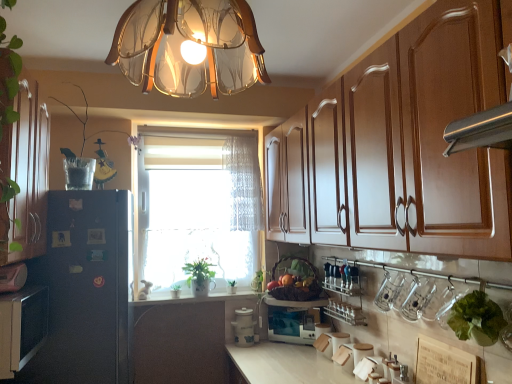
This screenshot has height=384, width=512. What are the coordinates of `black matte refrigerator at left` in the screenshot? It's located at (88, 288).

What is the approximate width of black matte refrigerator at left?

black matte refrigerator at left is 22.98 inches wide.

Describe the element at coordinates (22, 327) in the screenshot. This screenshot has width=512, height=384. I see `black matte refrigerator at left, which is counted as the 2th cabinetry, starting from the left` at that location.

Measure the distance between translucent glass vase at left, positioned as the 4th plant in right-to-left order, and camera.

A distance of 2.31 meters exists between translucent glass vase at left, positioned as the 4th plant in right-to-left order, and camera.

You are a GUI agent. You are given a task and a screenshot of the screen. Output one action in this format:
    pyautogui.click(x=<x>, y=<y>)
    Task: Click on the white glossy counter top at center
    
    Given the screenshot: What is the action you would take?
    click(x=195, y=297)

Where is `white lace curtain at center`? The image size is (512, 384). white lace curtain at center is located at coordinates (244, 182).

What are the coordinates of `green leafy plant at window, which is counted as the second plant, starting from the left` in the screenshot? It's located at (175, 288).

From a real-world perspective, who is located lower, green leafy lettuce at lower right, marked as the 2th plant in a top-to-bottom arrangement, or green matte plant at center?

green matte plant at center is physically lower.

Is green matte plant at center located within green leafy lettuce at lower right, positioned as the fourth plant in back-to-front order?

Definitely not — green matte plant at center is not inside green leafy lettuce at lower right, positioned as the fourth plant in back-to-front order.

Can you confirm if green leafy lettuce at lower right, the 1th plant in the front-to-back sequence, is bigger than green matte plant at center?

Incorrect, green leafy lettuce at lower right, the 1th plant in the front-to-back sequence, is not larger than green matte plant at center.

How many degrees apart are the facing directions of green leafy lettuce at lower right, marked as the 2th plant in a top-to-bottom arrangement, and green matte plant at center?

The angular difference between green leafy lettuce at lower right, marked as the 2th plant in a top-to-bottom arrangement, and green matte plant at center is 88.9 degrees.

Is the position of metallic silver spice rack at lower center less distant than that of green leafy lettuce at lower right, the 1th plant in the front-to-back sequence?

That is False.

Is metallic silver spice rack at lower center taller than green leafy lettuce at lower right, marked as the 2th plant in a top-to-bottom arrangement?

Yes.

From a real-world perspective, is metallic silver spice rack at lower center over green leafy lettuce at lower right, marked as the 2th plant in a top-to-bottom arrangement?

No, from a real-world perspective, metallic silver spice rack at lower center is not over green leafy lettuce at lower right, marked as the 2th plant in a top-to-bottom arrangement

Are metallic silver spice rack at lower center and green leafy lettuce at lower right, the 1th plant when ordered from right to left, making contact?

No, metallic silver spice rack at lower center is not making contact with green leafy lettuce at lower right, the 1th plant when ordered from right to left.

From a real-world perspective, is green matte plant at center positioned under metallic silver spice rack at lower center based on gravity?

No, from a real-world perspective, green matte plant at center is not beneath metallic silver spice rack at lower center.

Is the depth of green matte plant at center greater than that of metallic silver spice rack at lower center?

Yes, it is.

Looking at their sizes, would you say green matte plant at center is wider or thinner than metallic silver spice rack at lower center?

In the image, green matte plant at center appears to be more narrow than metallic silver spice rack at lower center.

From their relative heights in the image, would you say green matte plant at center is taller or shorter than metallic silver spice rack at lower center?

In the image, green matte plant at center appears to be shorter than metallic silver spice rack at lower center.

From the image's perspective, is black matte refrigerator at left, which is counted as the 2th cabinetry, starting from the left, on green leafy plant at window, the 1th plant from the back?

Indeed, from the image's perspective, black matte refrigerator at left, which is counted as the 2th cabinetry, starting from the left, is shown above green leafy plant at window, the 1th plant from the back.

Which is behind, point (37, 305) or point (233, 282)?

Positioned behind is point (233, 282).

Consider the image. In the image, is black matte refrigerator at left, marked as the 2th cabinetry in a right-to-left arrangement, positioned in front of or behind green leafy plant at window, the 3th plant when ordered from top to bottom?

In the image, black matte refrigerator at left, marked as the 2th cabinetry in a right-to-left arrangement, appears in front of green leafy plant at window, the 3th plant when ordered from top to bottom.

The width and height of the screenshot is (512, 384). What are the coordinates of `the 1st cabinetry in front of the green leafy plant at window, arranged as the 2th plant when viewed from the right` in the screenshot? It's located at (22, 327).

Can you confirm if translucent glass chandelier at upper center is positioned to the left of translucent glass vase at left, which is the fourth plant from bottom to top?

In fact, translucent glass chandelier at upper center is to the right of translucent glass vase at left, which is the fourth plant from bottom to top.

Is translucent glass chandelier at upper center in contact with translucent glass vase at left, positioned as the 4th plant in right-to-left order?

translucent glass chandelier at upper center and translucent glass vase at left, positioned as the 4th plant in right-to-left order, are clearly separated.

From the image's perspective, is translucent glass chandelier at upper center above or below translucent glass vase at left, the first plant in the left-to-right sequence?

translucent glass chandelier at upper center is above translucent glass vase at left, the first plant in the left-to-right sequence.

How far apart are green leafy plant at window, the 3th plant when ordered from top to bottom, and green matte plant at center?

They are 8.60 inches apart.

This screenshot has height=384, width=512. I want to click on houseplant lying above the green leafy plant at window, arranged as the 2th plant when viewed from the right (from the image's perspective), so click(199, 276).

Is green leafy plant at window, which appears as the 4th plant when viewed from the front, facing towards green matte plant at center?

No, green leafy plant at window, which appears as the 4th plant when viewed from the front, does not turn towards green matte plant at center.

Is green leafy plant at window, arranged as the 2th plant when viewed from the right, in front of or behind green matte plant at center in the image?

In the image, green leafy plant at window, arranged as the 2th plant when viewed from the right, appears behind green matte plant at center.

Which of these two, white ceramic container at center, the second appliance in the right-to-left sequence, or matte black microwave at center, the second appliance in the left-to-right sequence, stands taller?

With more height is white ceramic container at center, the second appliance in the right-to-left sequence.

Which is in front, point (250, 315) or point (306, 310)?

The point (306, 310) is closer.

How many degrees apart are the facing directions of white ceramic container at center, the second appliance in the right-to-left sequence, and matte black microwave at center, the second appliance in the left-to-right sequence?

The angle between the facing direction of white ceramic container at center, the second appliance in the right-to-left sequence, and the facing direction of matte black microwave at center, the second appliance in the left-to-right sequence, is 42.2 degrees.

Could you tell me if white ceramic container at center, the second appliance in the right-to-left sequence, is turned towards matte black microwave at center, which is the first appliance from right to left?

No, white ceramic container at center, the second appliance in the right-to-left sequence, is not aimed at matte black microwave at center, which is the first appliance from right to left.

At what (x,y) coordinates should I click in order to perform the action: click on the 1st plant positioned above the green matte plant at center (from a real-world perspective). Please return your answer as a coordinate pair (x, y). Looking at the image, I should click on (477, 319).

You are a GUI agent. You are given a task and a screenshot of the screen. Output one action in this format:
    pyautogui.click(x=<x>, y=<y>)
    Task: Click on the shelf on the left of green leafy lettuce at lower right, placed as the fourth plant when sorted from left to right
    
    Given the screenshot: What is the action you would take?
    pyautogui.click(x=344, y=291)

From the image, which object appears to be nearer to translucent glass vase at left, the 1th plant from the top, translucent glass chandelier at upper center or matte white cabinet at left, acting as the 3th cabinetry starting from the right?

matte white cabinet at left, acting as the 3th cabinetry starting from the right, is positioned closer to the anchor translucent glass vase at left, the 1th plant from the top.

When comparing their distances from green leafy plant at window, arranged as the 3th plant when viewed from the left, does metallic silver spice rack at lower center or green leafy plant at window, which is counted as the fourth plant, starting from the top, seem further?

metallic silver spice rack at lower center is further to green leafy plant at window, arranged as the 3th plant when viewed from the left.

Considering their positions, is green matte plant at center positioned closer to white glossy counter top at center than translucent glass chandelier at upper center?

The object closer to white glossy counter top at center is green matte plant at center.

Looking at the image, which one is located closer to matte white cabinet at left, which is the first cabinetry from left to right, green leafy lettuce at lower right, which is counted as the 3th plant, starting from the bottom, or matte black microwave at center, which is the first appliance from right to left?

Based on the image, green leafy lettuce at lower right, which is counted as the 3th plant, starting from the bottom, appears to be nearer to matte white cabinet at left, which is the first cabinetry from left to right.

When comparing their distances from translucent glass chandelier at upper center, does brown wood cabinet at upper right, positioned as the 3th cabinetry in left-to-right order, or white lace curtain at center seem further?

Based on the image, white lace curtain at center appears to be further to translucent glass chandelier at upper center.

From the image, which object appears to be nearer to green matte plant at center, matte black microwave at center, the second appliance in the left-to-right sequence, or white lace curtain at center?

Among the two, white lace curtain at center is located nearer to green matte plant at center.

Estimate the real-world distances between objects in this image. Which object is further from white glossy counter top at center, translucent glass chandelier at upper center or matte white cabinet at left, which is the first cabinetry from left to right?

translucent glass chandelier at upper center.

Considering their positions, is black matte refrigerator at left positioned closer to green matte plant at center than green leafy plant at window, which is counted as the second plant, starting from the left?

Based on the image, green leafy plant at window, which is counted as the second plant, starting from the left, appears to be nearer to green matte plant at center.

Where is `curtain located between translucent glass chandelier at upper center and green leafy plant at window, which is the second plant in back-to-front order, in the depth direction`? Image resolution: width=512 pixels, height=384 pixels. curtain located between translucent glass chandelier at upper center and green leafy plant at window, which is the second plant in back-to-front order, in the depth direction is located at coordinates (244, 182).

Find the location of a particular element. The width and height of the screenshot is (512, 384). fridge between translucent glass chandelier at upper center and white ceramic container at center, which is counted as the 1th appliance, starting from the left, in the front-back direction is located at coordinates (88, 288).

I want to click on counter top between black matte refrigerator at left, marked as the 2th cabinetry in a right-to-left arrangement, and white lace curtain at center in the front-back direction, so tap(195, 297).

Locate an element on the screen. shelf between translucent glass vase at left, the 1th plant from the top, and green leafy lettuce at lower right, the 1th plant in the front-to-back sequence is located at coordinates tap(344, 291).